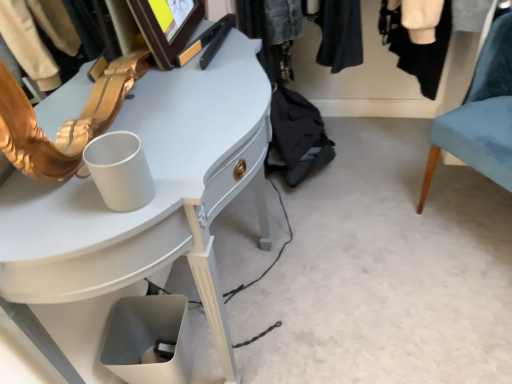
The width and height of the screenshot is (512, 384). Describe the element at coordinates (156, 193) in the screenshot. I see `white glossy desk at upper left` at that location.

Find the location of a particular element. The image size is (512, 384). denim jacket at upper center is located at coordinates (383, 74).

Considering the relative sizes of white glossy desk at upper left and denim jacket at upper center in the image provided, is white glossy desk at upper left bigger than denim jacket at upper center?

Correct, white glossy desk at upper left is larger in size than denim jacket at upper center.

How many degrees apart are the facing directions of white glossy desk at upper left and denim jacket at upper center?

92.2 degrees separate the facing orientations of white glossy desk at upper left and denim jacket at upper center.

Is white glossy desk at upper left completely or partially outside of denim jacket at upper center?

white glossy desk at upper left is positioned outside denim jacket at upper center.

Is point (231, 40) closer to viewer compared to point (470, 70)?

Yes, it is.

From the image's perspective, relative to white glossy desk at upper left, is velvet teal chair at right above or below?

Based on their image positions, velvet teal chair at right is located above white glossy desk at upper left.

Is velvet teal chair at right completely or partially outside of white glossy desk at upper left?

Answer: Absolutely, velvet teal chair at right is external to white glossy desk at upper left.

Considering the sizes of velvet teal chair at right and white glossy desk at upper left in the image, is velvet teal chair at right bigger or smaller than white glossy desk at upper left?

In the image, velvet teal chair at right appears to be smaller than white glossy desk at upper left.

Is velvet teal chair at right beside denim jacket at upper center?

No, velvet teal chair at right is not making contact with denim jacket at upper center.

Is velvet teal chair at right taller or shorter than denim jacket at upper center?

Clearly, velvet teal chair at right is taller compared to denim jacket at upper center.

How many degrees apart are the facing directions of velvet teal chair at right and denim jacket at upper center?

The angular difference between velvet teal chair at right and denim jacket at upper center is 48.2 degrees.

Is point (441, 126) positioned behind point (302, 71)?

No, it is in front of (302, 71).

Locate an element on the screen. desk on the left of the denim jacket at upper center is located at coordinates (156, 193).

Which is more to the right, denim jacket at upper center or white glossy desk at upper left?

From the viewer's perspective, denim jacket at upper center appears more on the right side.

Does denim jacket at upper center have a larger size compared to white glossy desk at upper left?

No, denim jacket at upper center is not bigger than white glossy desk at upper left.

Looking at this image, from the image's perspective, is denim jacket at upper center beneath white glossy desk at upper left?

No, from the image's perspective, denim jacket at upper center is not beneath white glossy desk at upper left.

Considering the positions of objects denim jacket at upper center and velvet teal chair at right in the image provided, who is more to the left, denim jacket at upper center or velvet teal chair at right?

Positioned to the left is denim jacket at upper center.

From the picture: From a real-world perspective, which object rests below the other?

From a 3D spatial view, velvet teal chair at right is below.

Are denim jacket at upper center and velvet teal chair at right beside each other?

They are not placed beside each other.

Does denim jacket at upper center come behind velvet teal chair at right?

Yes, the depth of denim jacket at upper center is greater than that of velvet teal chair at right.

Is point (13, 277) closer to camera compared to point (492, 75)?

Yes, it is.

Could you tell me if white glossy desk at upper left is facing velvet teal chair at right?

Yes, white glossy desk at upper left is turned towards velvet teal chair at right.

The image size is (512, 384). I want to click on chair above the white glossy desk at upper left (from the image's perspective), so click(x=481, y=115).

Between white glossy desk at upper left and velvet teal chair at right, which one appears on the right side from the viewer's perspective?

velvet teal chair at right is more to the right.

You are a GUI agent. You are given a task and a screenshot of the screen. Output one action in this format:
    pyautogui.click(x=<x>, y=<y>)
    Task: Click on the closet above the white glossy desk at upper left (from a real-world perspective)
    
    Given the screenshot: What is the action you would take?
    pyautogui.click(x=383, y=74)

What are the coordinates of `chair below the white glossy desk at upper left (from a real-world perspective)` in the screenshot? It's located at (481, 115).

Estimate the real-world distances between objects in this image. Which object is further from denim jacket at upper center, white glossy desk at upper left or velvet teal chair at right?

white glossy desk at upper left is further to denim jacket at upper center.

Considering their positions, is white glossy desk at upper left positioned closer to velvet teal chair at right than denim jacket at upper center?

Based on the image, denim jacket at upper center appears to be nearer to velvet teal chair at right.

Estimate the real-world distances between objects in this image. Which object is further from velvet teal chair at right, denim jacket at upper center or white glossy desk at upper left?

white glossy desk at upper left.

Looking at the image, which one is located closer to white glossy desk at upper left, denim jacket at upper center or velvet teal chair at right?

Among the two, velvet teal chair at right is located nearer to white glossy desk at upper left.

From the image, which object appears to be nearer to white glossy desk at upper left, velvet teal chair at right or denim jacket at upper center?

velvet teal chair at right lies closer to white glossy desk at upper left than the other object.

Which object lies further to the anchor point denim jacket at upper center, velvet teal chair at right or white glossy desk at upper left?

Based on the image, white glossy desk at upper left appears to be further to denim jacket at upper center.

Locate an element on the screen. This screenshot has height=384, width=512. closet between white glossy desk at upper left and velvet teal chair at right from left to right is located at coordinates (383, 74).